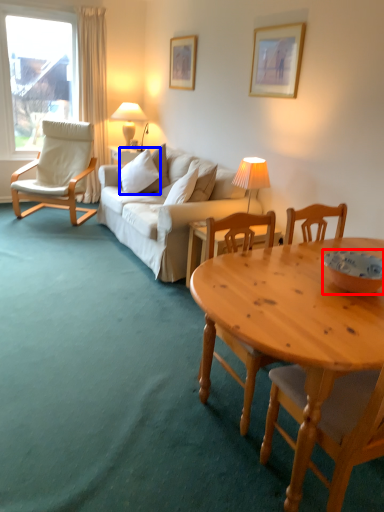
Question: Which point is further to the camera, bowl (highlighted by a red box) or pillow (highlighted by a blue box)?

Choices:
 (A) bowl
 (B) pillow

Answer: (B)